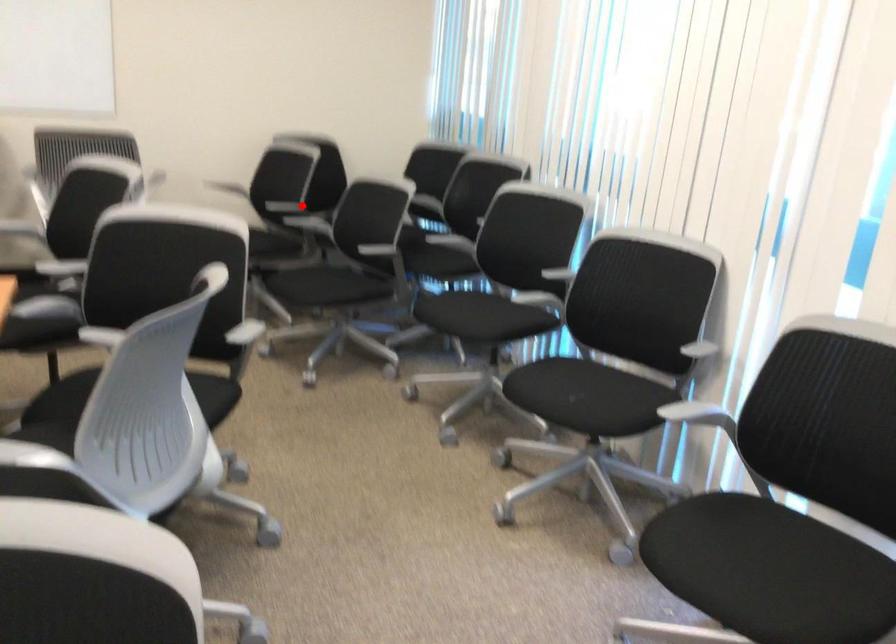
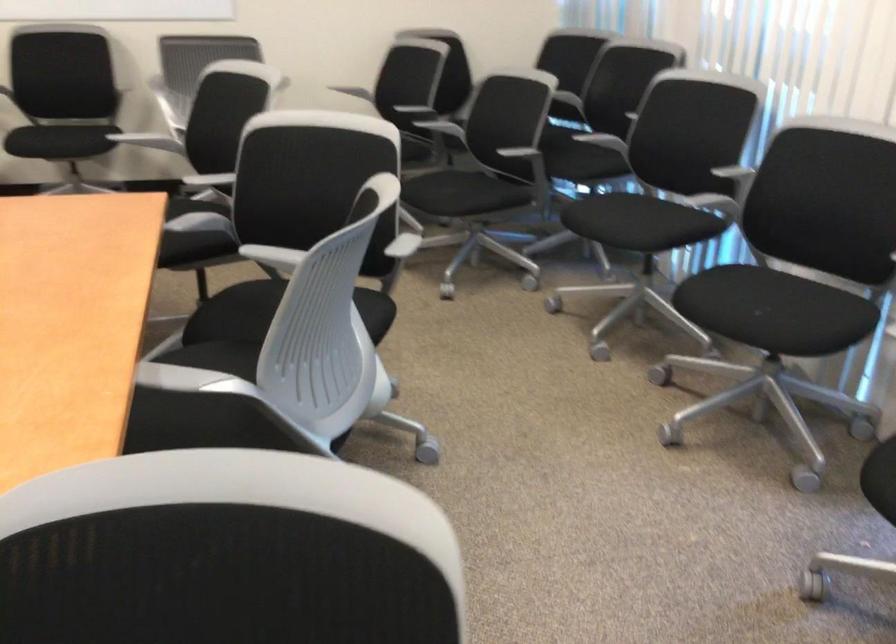
Find the pixel in the second image that matches the highlighted location in the first image.

(432, 107)